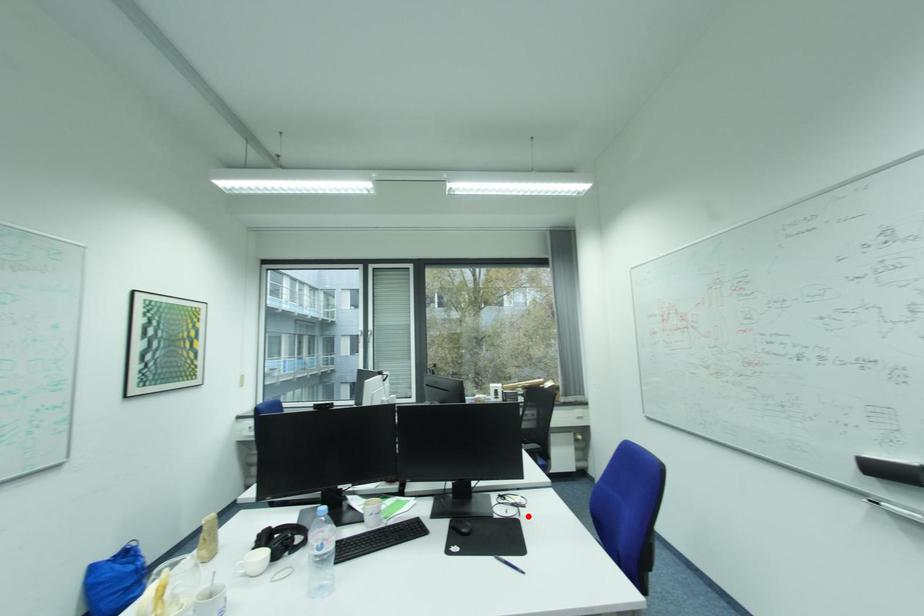
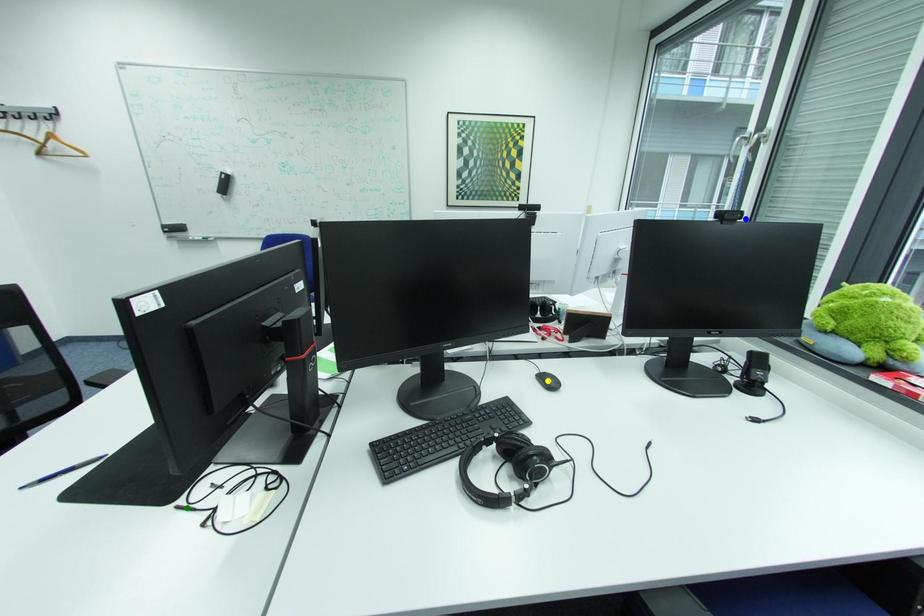
Question: I am providing you with two images of the same scene from different viewpoints. A red point is marked on the first image. You are given multiple points on the second image. Can you choose the point in image 2 that corresponds to the point in image 1?

Choices:
 (A) green point
 (B) yellow point
 (C) blue point

Answer: (A)